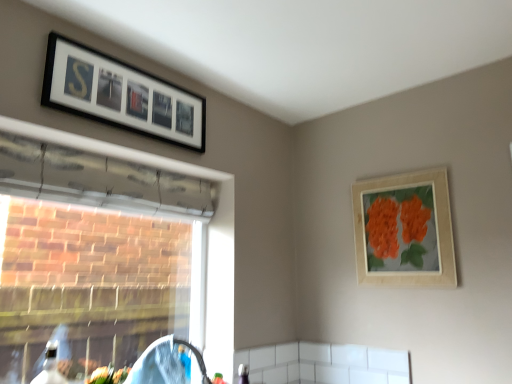
Question: From the image's perspective, is wooden picture frame at upper right, which appears as the first picture frame when viewed from the right, below transparent plastic window at left?

Choices:
 (A) yes
 (B) no

Answer: (B)

Question: Considering the relative sizes of wooden picture frame at upper right, which appears as the first picture frame when viewed from the right, and transparent plastic window at left in the image provided, is wooden picture frame at upper right, which appears as the first picture frame when viewed from the right, smaller than transparent plastic window at left?

Choices:
 (A) no
 (B) yes

Answer: (B)

Question: Is wooden picture frame at upper right, which appears as the first picture frame when viewed from the right, shorter than transparent plastic window at left?

Choices:
 (A) yes
 (B) no

Answer: (A)

Question: Is wooden picture frame at upper right, which is the 1th picture frame in bottom-to-top order, outside transparent plastic window at left?

Choices:
 (A) no
 (B) yes

Answer: (B)

Question: Is wooden picture frame at upper right, the 2th picture frame positioned from the left, positioned in front of transparent plastic window at left?

Choices:
 (A) no
 (B) yes

Answer: (A)

Question: Is point (71, 82) closer or farther from the camera than point (231, 319)?

Choices:
 (A) farther
 (B) closer

Answer: (B)

Question: From a real-world perspective, is black matte picture frame at upper left, the 1th picture frame positioned from the left, above or below transparent plastic window at left?

Choices:
 (A) above
 (B) below

Answer: (A)

Question: Which is correct: black matte picture frame at upper left, which ranks as the first picture frame in top-to-bottom order, is inside transparent plastic window at left, or outside of it?

Choices:
 (A) inside
 (B) outside

Answer: (B)

Question: Considering their positions, is black matte picture frame at upper left, the 1th picture frame positioned from the left, located in front of or behind transparent plastic window at left?

Choices:
 (A) behind
 (B) front

Answer: (A)

Question: Is transparent plastic window at left taller or shorter than black matte picture frame at upper left, the 2th picture frame positioned from the bottom?

Choices:
 (A) tall
 (B) short

Answer: (A)

Question: Based on their sizes in the image, would you say transparent plastic window at left is bigger or smaller than black matte picture frame at upper left, the 2th picture frame positioned from the bottom?

Choices:
 (A) small
 (B) big

Answer: (B)

Question: From the image's perspective, is transparent plastic window at left above or below black matte picture frame at upper left, the 1th picture frame positioned from the left?

Choices:
 (A) below
 (B) above

Answer: (A)

Question: Is transparent plastic window at left wider or thinner than black matte picture frame at upper left, the 2th picture frame positioned from the bottom?

Choices:
 (A) thin
 (B) wide

Answer: (B)

Question: Considering the positions of black matte picture frame at upper left, which ranks as the first picture frame in top-to-bottom order, and wooden picture frame at upper right, which is the 1th picture frame in bottom-to-top order, in the image, is black matte picture frame at upper left, which ranks as the first picture frame in top-to-bottom order, wider or thinner than wooden picture frame at upper right, which is the 1th picture frame in bottom-to-top order,?

Choices:
 (A) thin
 (B) wide

Answer: (B)

Question: In terms of height, does black matte picture frame at upper left, the second picture frame in the right-to-left sequence, look taller or shorter compared to wooden picture frame at upper right, which is counted as the 2th picture frame, starting from the top?

Choices:
 (A) tall
 (B) short

Answer: (B)